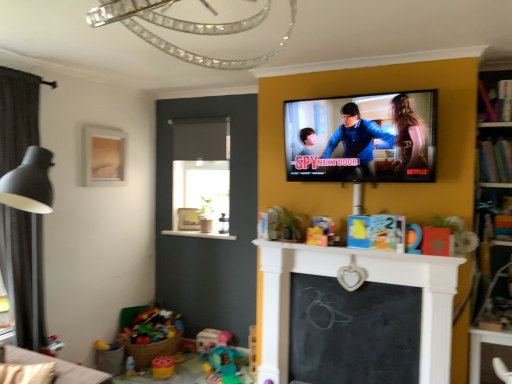
Question: From a real-world perspective, is black chalkboard at center above or below matte orange toy at center, marked as the 4th toy in a back-to-front arrangement?

Choices:
 (A) above
 (B) below

Answer: (B)

Question: Considering the positions of black chalkboard at center and matte orange toy at center, acting as the 1th toy starting from the top, in the image, is black chalkboard at center wider or thinner than matte orange toy at center, acting as the 1th toy starting from the top,?

Choices:
 (A) thin
 (B) wide

Answer: (A)

Question: Based on their relative distances, which object is farther from the wooden frame at upper left, the 2th picture frame from the right?

Choices:
 (A) dark grey fabric curtain at left
 (B) translucent plastic cup at lower left, acting as the 1th toy starting from the left
 (C) black chalkboard at center
 (D) wooden bookshelf at upper right, the first shelf in the bottom-to-top sequence
 (E) matte orange toy at center, which ranks as the first toy in right-to-left order

Answer: (D)

Question: Which of these objects is positioned closest to the dark grey fabric curtain at left?

Choices:
 (A) matte black tv at upper right
 (B) plastic teal toy at lower center, which is the second toy from bottom to top
 (C) black chalkboard at center
 (D) wooden bookshelf at upper right, the 2th shelf ordered from the bottom
 (E) wooden bookshelf at upper right, the first shelf in the bottom-to-top sequence

Answer: (B)